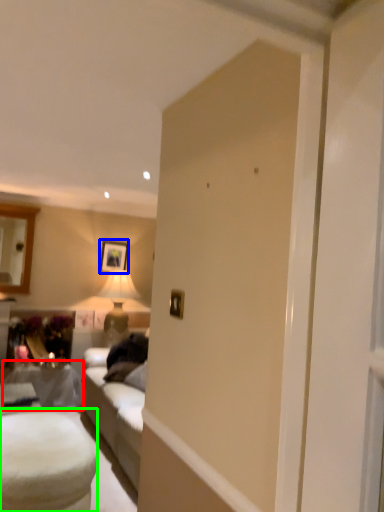
Question: Considering the real-world distances, which object is closest to table (highlighted by a red box)? picture frame (highlighted by a blue box) or table (highlighted by a green box).

Choices:
 (A) picture frame
 (B) table

Answer: (B)